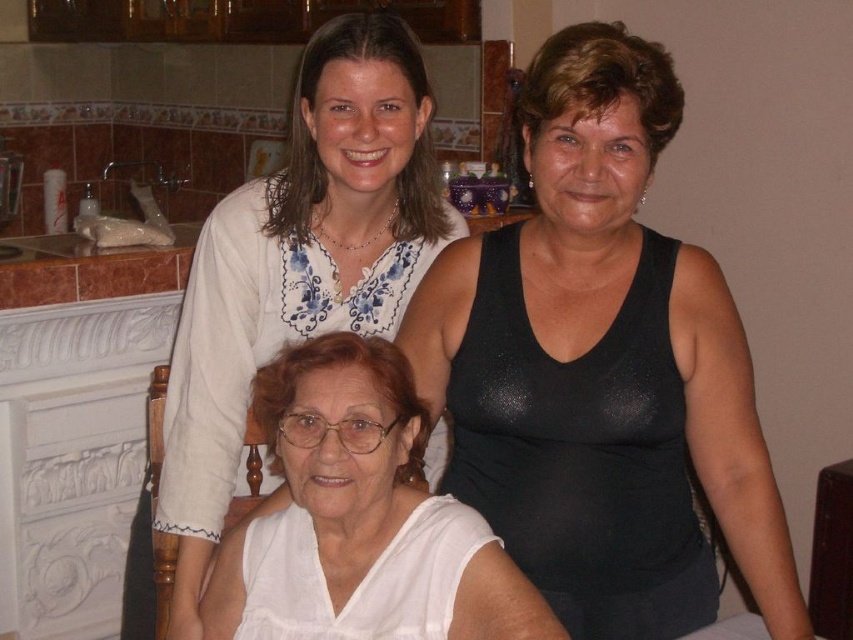
Is white fabric at center smaller than white matte shirt at center?

Actually, white fabric at center might be larger than white matte shirt at center.

Does white fabric at center appear on the left side of white matte shirt at center?

Indeed, white fabric at center is positioned on the left side of white matte shirt at center.

Find the location of `white fabric at center`. white fabric at center is located at coordinates (299, 264).

Does black shiny tank top at upper right come behind white fabric at center?

No, black shiny tank top at upper right is in front of white fabric at center.

Which is in front, point (503, 529) or point (380, 48)?

Point (503, 529)

Does point (699, 353) come behind point (311, 317)?

No, it is not.

Where is `black shiny tank top at upper right`? black shiny tank top at upper right is located at coordinates (602, 369).

Can you confirm if black shiny tank top at upper right is positioned to the right of white matte shirt at center?

Indeed, black shiny tank top at upper right is positioned on the right side of white matte shirt at center.

Is black shiny tank top at upper right thinner than white matte shirt at center?

No.

This screenshot has width=853, height=640. I want to click on black shiny tank top at upper right, so click(x=602, y=369).